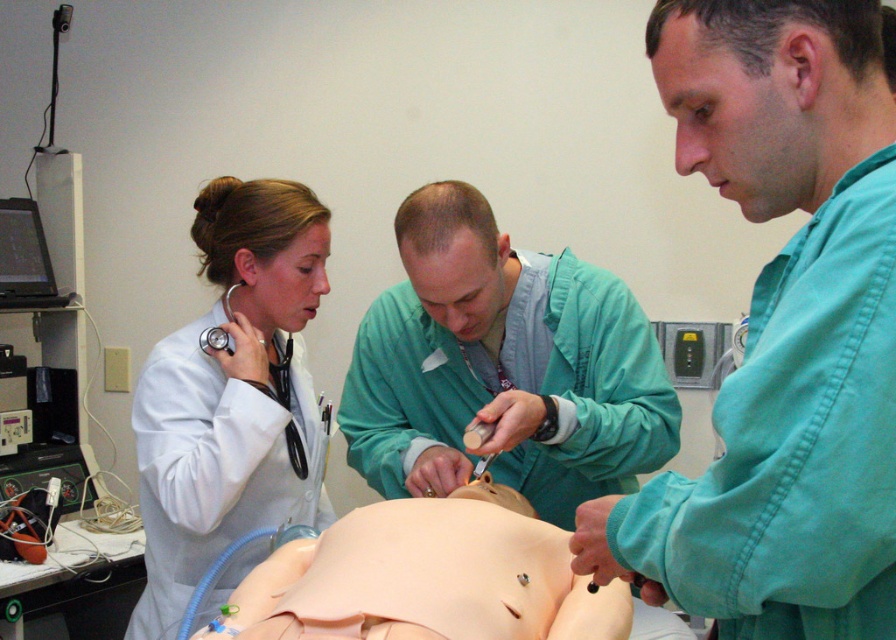
Question: Which object is the closest to the matte black stethoscope at left?

Choices:
 (A) blue rubber tube at lower center
 (B) pale skin mannequin torso at center

Answer: (A)

Question: Does green matte/surgical gown at center have a larger size compared to blue rubber tube at lower center?

Choices:
 (A) no
 (B) yes

Answer: (B)

Question: Is green matte/surgical gown at center above pale skin mannequin torso at center?

Choices:
 (A) no
 (B) yes

Answer: (B)

Question: Is green matte/surgical gown at center smaller than white matte coat at left?

Choices:
 (A) yes
 (B) no

Answer: (B)

Question: Among these points, which one is farthest from the camera?

Choices:
 (A) (458, 300)
 (B) (287, 605)

Answer: (A)

Question: Which point is closer to the camera?

Choices:
 (A) (208, 548)
 (B) (283, 365)
 (C) (230, 609)

Answer: (C)